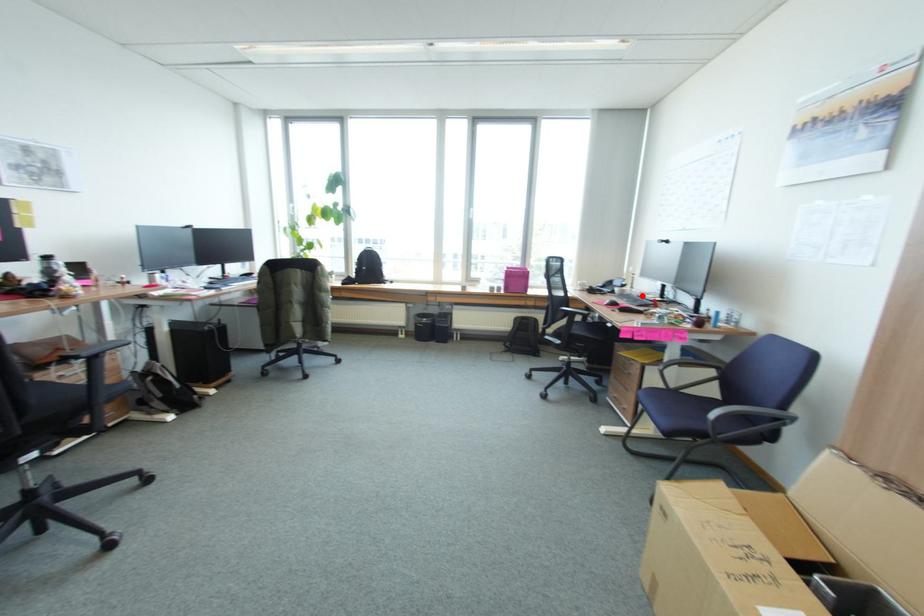
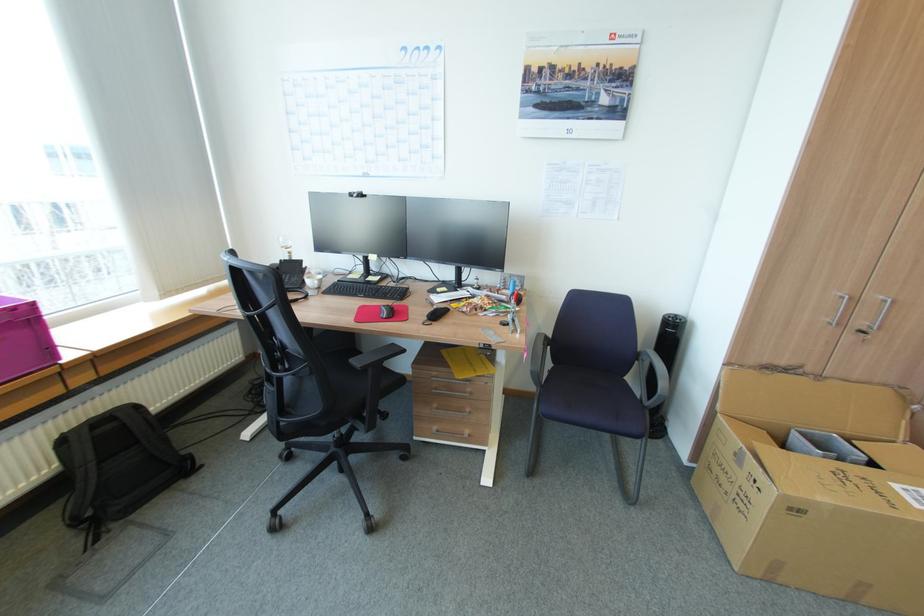
The point at the highlighted location is marked in the first image. Where is the corresponding point in the second image?

(344, 281)